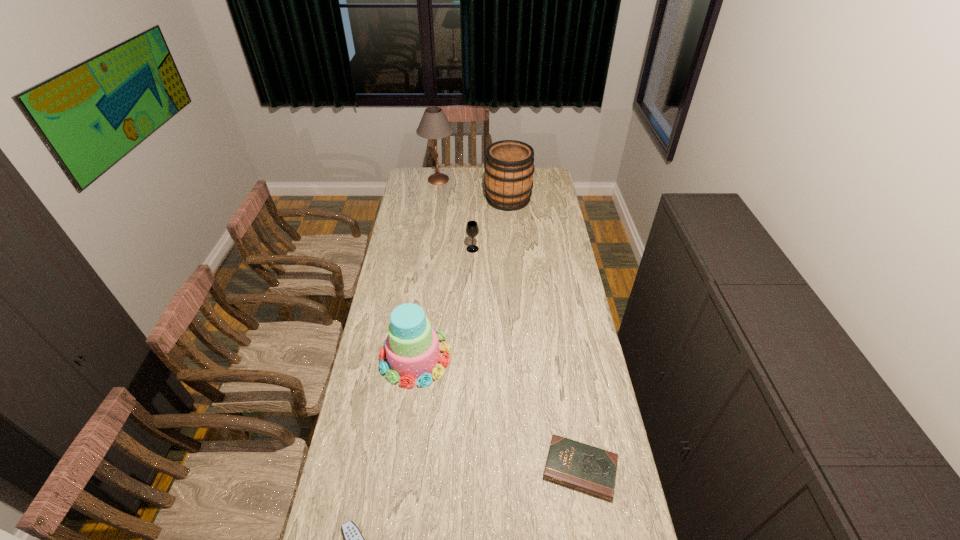
Identify the location of the tallest object. (434, 124).

At what (x,y) coordinates should I click in order to perform the action: click on the second tallest object. Please return your answer as a coordinate pair (x, y). This screenshot has height=540, width=960. Looking at the image, I should click on (509, 168).

The width and height of the screenshot is (960, 540). What are the coordinates of `the fourth farthest object` in the screenshot? It's located at (412, 350).

Find the location of a particular element. cake is located at coordinates (412, 350).

At what (x,y) coordinates should I click in order to perform the action: click on wineglass. Please return your answer as a coordinate pair (x, y). Looking at the image, I should click on (472, 229).

The width and height of the screenshot is (960, 540). I want to click on the fourth object from left to right, so click(472, 229).

Identify the location of the fifth tallest object. (573, 464).

Locate an element on the screen. The height and width of the screenshot is (540, 960). Bible is located at coordinates (573, 464).

Find the location of a particular element. The width and height of the screenshot is (960, 540). free space located on the front-facing side of the tallest object is located at coordinates (500, 179).

Find the location of `free space located 0.080m on the back of the cider`. free space located 0.080m on the back of the cider is located at coordinates (506, 179).